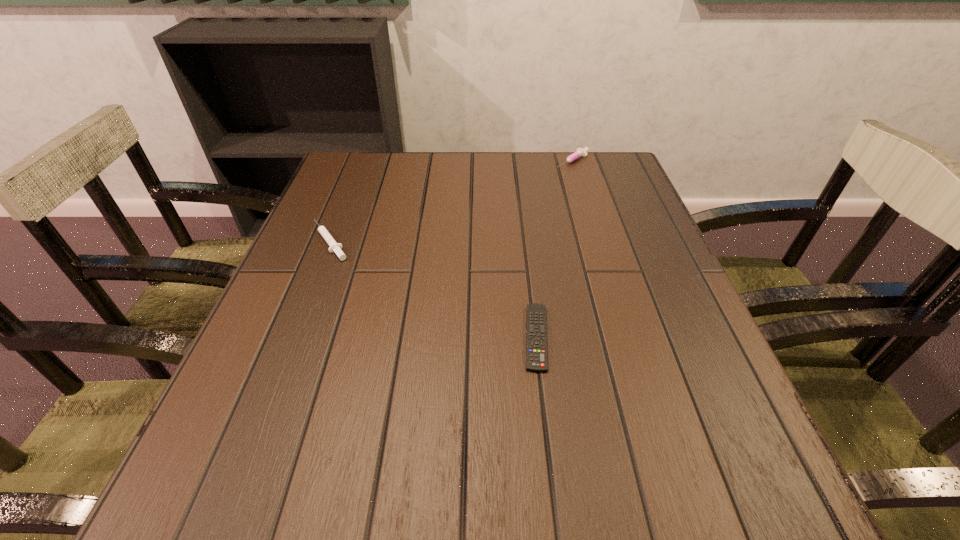
This screenshot has width=960, height=540. I want to click on object located in the left edge section of the desktop, so click(x=335, y=247).

Locate an element on the screen. The width and height of the screenshot is (960, 540). object positioned at the right edge is located at coordinates (580, 152).

The height and width of the screenshot is (540, 960). Identify the location of object present at the far right corner. (580, 152).

You are a GUI agent. You are given a task and a screenshot of the screen. Output one action in this format:
    pyautogui.click(x=<x>, y=<y>)
    Task: Click on the vacant space at the far edge
    This screenshot has width=960, height=540.
    Given the screenshot: What is the action you would take?
    pyautogui.click(x=516, y=159)

Locate an element on the screen. The height and width of the screenshot is (540, 960). free space at the near edge of the desktop is located at coordinates (605, 522).

Locate an element on the screen. Image resolution: width=960 pixels, height=540 pixels. vacant region at the left edge is located at coordinates (324, 305).

I want to click on vacant space at the right edge, so click(660, 276).

You are a GUI agent. You are given a task and a screenshot of the screen. Output one action in this format:
    pyautogui.click(x=<x>, y=<y>)
    Task: Click on the vacant area at the far left corner of the desktop
    The height and width of the screenshot is (540, 960).
    Given the screenshot: What is the action you would take?
    pyautogui.click(x=355, y=185)

The width and height of the screenshot is (960, 540). I want to click on vacant area at the far right corner, so click(x=623, y=182).

This screenshot has height=540, width=960. Find the location of `free space between the rightmost object and the nearest object`. free space between the rightmost object and the nearest object is located at coordinates (554, 249).